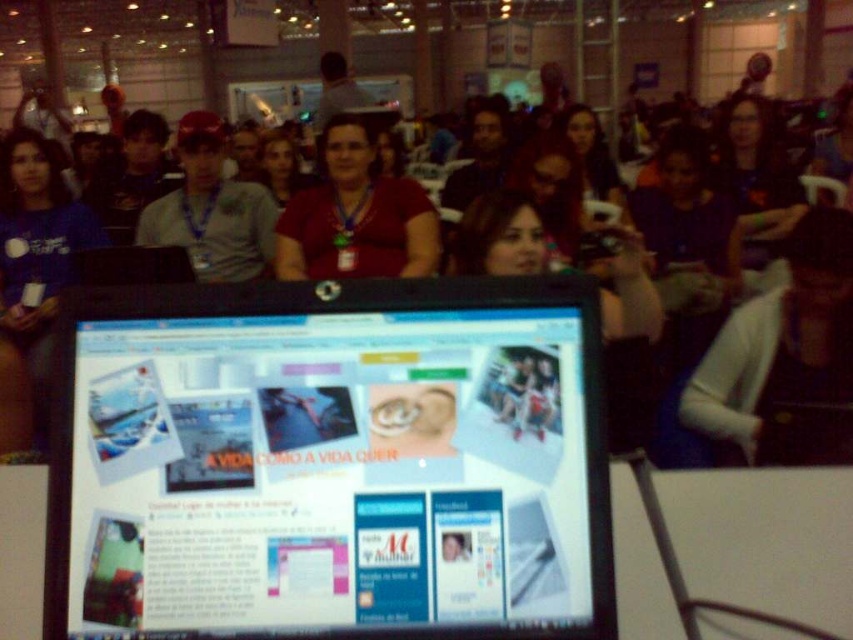
You are sitting in the conference room and want to look at the white sweater at center without moving your head. Can you see the matte black monitor at center in your line of sight?

The matte black monitor at center is below the white sweater at center, so if you are looking at the white sweater at center without moving your head, you can see the matte black monitor at center below it in your line of sight.

You are standing in the conference room and need to locate the matte black monitor at center. What are its coordinates?

The matte black monitor at center is located at coordinates (332, 464).